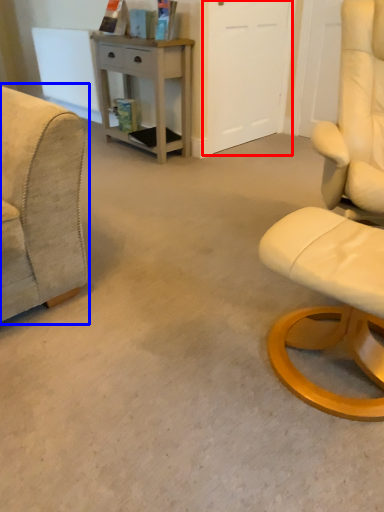
Question: Among these objects, which one is nearest to the camera, glass door (highlighted by a red box) or chair (highlighted by a blue box)?

Choices:
 (A) glass door
 (B) chair

Answer: (B)